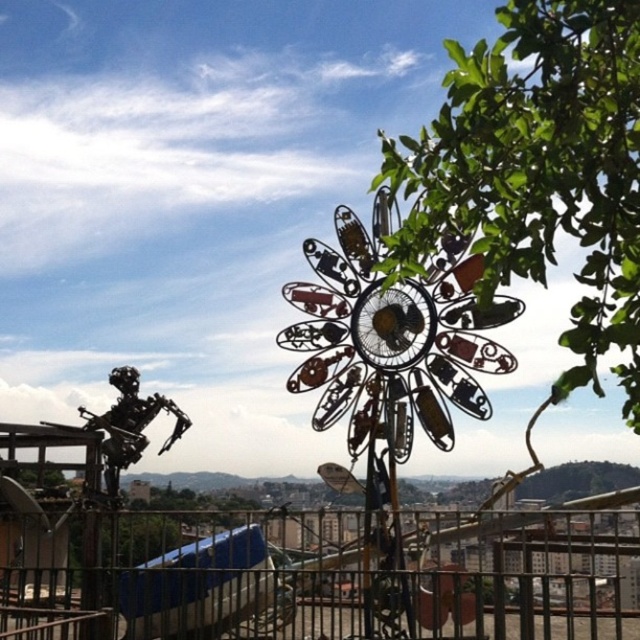
Based on the photo, you are standing on the rooftop and want to take a photo of the metallic robot at lower left without the metallic at lower center blocking the view. Is this possible based on their positions?

The metallic at lower center is in front of the metallic robot at lower left, so it would block the view. To take a photo of the metallic robot at lower left without obstruction, you would need to move to a position where the metallic at lower center is not between you and the metallic robot at lower left.

You are standing on the rooftop and want to take a photo of both the green leafy tree at upper right and the metallic robot at lower left. Which object should you focus on first to ensure both are in sharp focus?

You should focus on the green leafy tree at upper right first since it is closer to the viewer than the metallic robot at lower left. By focusing on the closer object, the robot will also be in focus due to the depth of field.